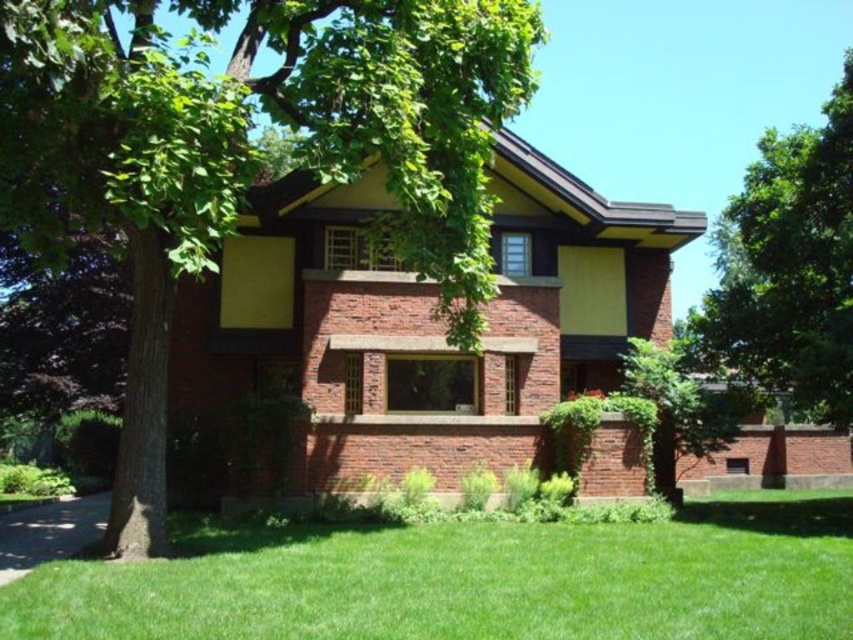
You are standing in front of the house and want to plant a new flower bed. The flower bed requires a spot that is both in front of the house and not directly under the tree. Based on the image, can you identify a suitable location for the flower bed using the green grass at lower center and green leafy tree at upper right?

The green grass at lower center is below the green leafy tree at upper right. Therefore, a suitable location for the flower bed would be on the green grass at lower center but not directly under the tree, ensuring it is in front of the house and away from the tree.

You are standing in front of the house and want to know which tree is nearer to you. Can you tell me which one is closer between the green leafy tree at upper left and the green leafy tree at upper right?

The green leafy tree at upper left is closer to the viewer than the green leafy tree at upper right.